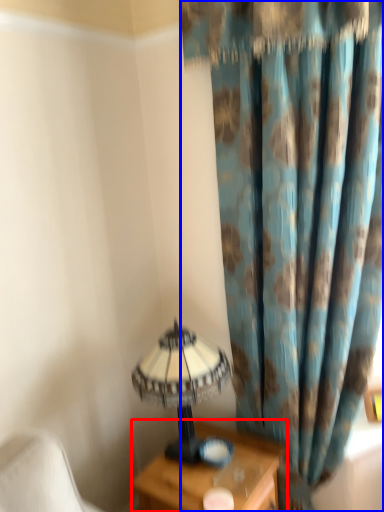
Question: Which object is further to the camera taking this photo, nightstand (highlighted by a red box) or curtain (highlighted by a blue box)?

Choices:
 (A) nightstand
 (B) curtain

Answer: (A)